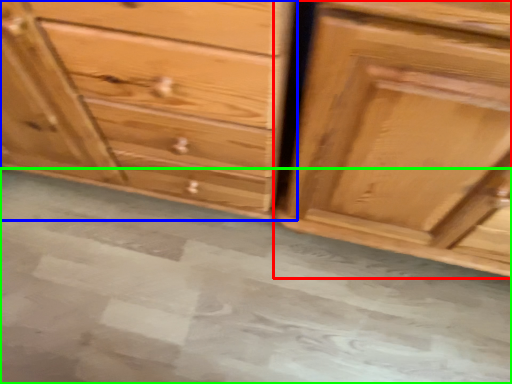
Question: Estimate the real-world distances between objects in this image. Which object is closer to chest of drawers (highlighted by a red box), chest of drawers (highlighted by a blue box) or concrete (highlighted by a green box)?

Choices:
 (A) chest of drawers
 (B) concrete

Answer: (A)